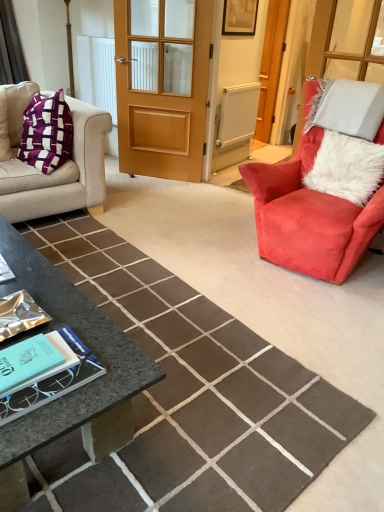
Image resolution: width=384 pixels, height=512 pixels. In order to click on vacant area that lies to the right of velvet beige couch at left in this screenshot , I will do `click(150, 218)`.